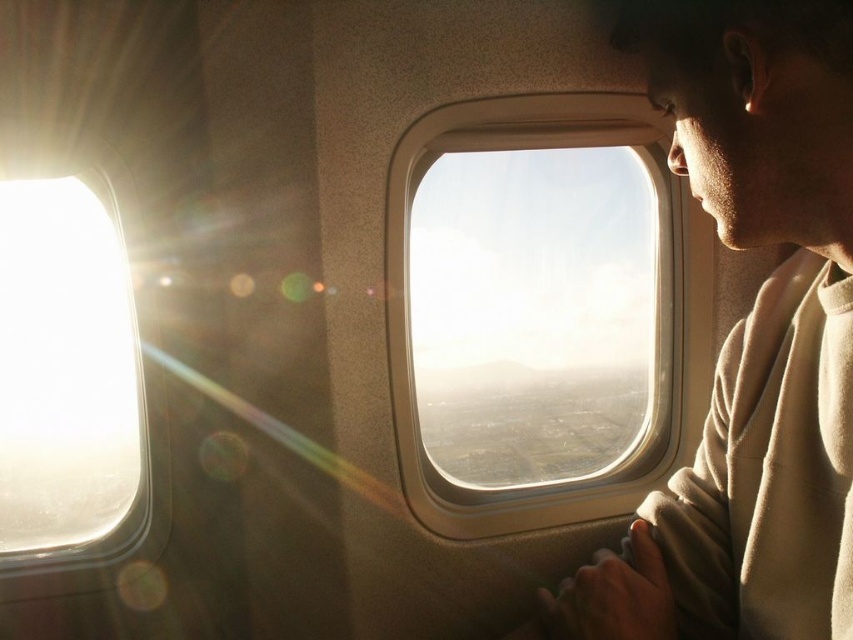
Question: Which point is farther to the camera?

Choices:
 (A) (693, 140)
 (B) (48, 426)

Answer: (B)

Question: Is transparent glass airplane window at left thinner than transparent glass airplane window at center?

Choices:
 (A) yes
 (B) no

Answer: (A)

Question: Estimate the real-world distances between objects in this image. Which object is closer to the transparent glass airplane window at center?

Choices:
 (A) beige fleece at upper right
 (B) transparent glass airplane window at left

Answer: (A)

Question: Which of the following is the closest to the observer?

Choices:
 (A) beige fleece at upper right
 (B) transparent glass airplane window at center
 (C) transparent glass airplane window at left

Answer: (A)

Question: Does beige fleece at upper right lie in front of transparent glass airplane window at left?

Choices:
 (A) yes
 (B) no

Answer: (A)

Question: Is transparent glass airplane window at left positioned in front of transparent glass airplane window at center?

Choices:
 (A) yes
 (B) no

Answer: (B)